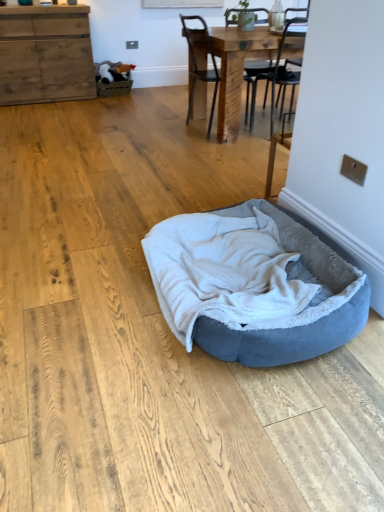
Question: Is wooden cabinet at upper left at the right side of soft gray plush dog bed at center?

Choices:
 (A) yes
 (B) no

Answer: (B)

Question: Would you say wooden cabinet at upper left is a long distance from soft gray plush dog bed at center?

Choices:
 (A) yes
 (B) no

Answer: (A)

Question: Can soft gray plush dog bed at center be found inside wooden cabinet at upper left?

Choices:
 (A) no
 (B) yes

Answer: (A)

Question: Could you tell me if wooden cabinet at upper left is turned towards soft gray plush dog bed at center?

Choices:
 (A) yes
 (B) no

Answer: (A)

Question: Considering the relative sizes of wooden cabinet at upper left and soft gray plush dog bed at center in the image provided, is wooden cabinet at upper left smaller than soft gray plush dog bed at center?

Choices:
 (A) no
 (B) yes

Answer: (A)

Question: Is the position of wooden cabinet at upper left more distant than that of soft gray plush dog bed at center?

Choices:
 (A) no
 (B) yes

Answer: (B)

Question: From the image's perspective, is black metal chair at upper center located above soft gray plush dog bed at center?

Choices:
 (A) no
 (B) yes

Answer: (B)

Question: Is black metal chair at upper center positioned before soft gray plush dog bed at center?

Choices:
 (A) yes
 (B) no

Answer: (B)

Question: Does black metal chair at upper center have a larger size compared to soft gray plush dog bed at center?

Choices:
 (A) yes
 (B) no

Answer: (A)

Question: Does black metal chair at upper center have a lesser height compared to soft gray plush dog bed at center?

Choices:
 (A) no
 (B) yes

Answer: (A)

Question: Is black metal chair at upper center taller than soft gray plush dog bed at center?

Choices:
 (A) yes
 (B) no

Answer: (A)

Question: Does black metal chair at upper center have a greater width compared to soft gray plush dog bed at center?

Choices:
 (A) no
 (B) yes

Answer: (A)

Question: Considering the relative positions of soft gray plush dog bed at center and wooden table at center in the image provided, is soft gray plush dog bed at center in front of wooden table at center?

Choices:
 (A) no
 (B) yes

Answer: (B)